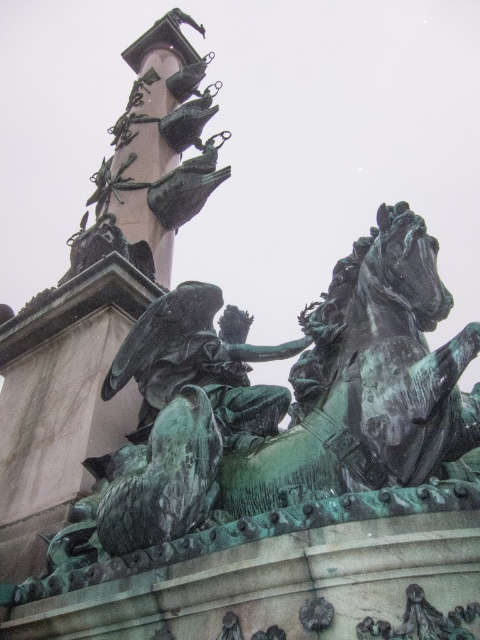
You are standing in front of the historical monument and notice two points marked on the sculpture. The first point is at coordinate point (429,424) and the second is at point (272,392). Which point is closer to your eyes?

Point (429,424) is closer to the camera than point (272,392), so the first point is closer to your eyes.

You are an art conservator examining the historical monument. You notice the green patina horse at center and the green patina statue at center. Which object is closer to you from your viewing position?

The green patina horse at center is closer to you because it is in front of the green patina statue at center.

You are an architect designing a virtual tour of the monument. To place a spotlight correctly, you need to know the exact 2D coordinates of the green patina horse at center. What are the coordinates?

The coordinates of the green patina horse at center are at point [368,381].